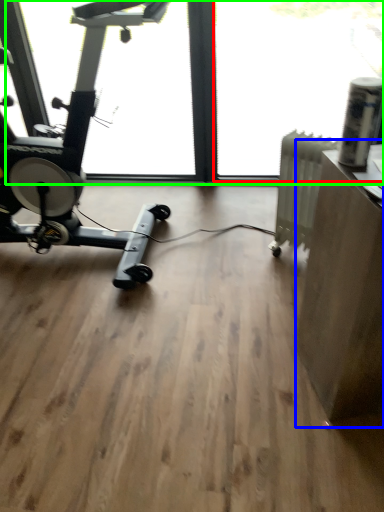
Question: Which object is the farthest from window screen (highlighted by a red box)? Choose among these: computer desk (highlighted by a blue box) or window screen (highlighted by a green box).

Choices:
 (A) computer desk
 (B) window screen

Answer: (A)